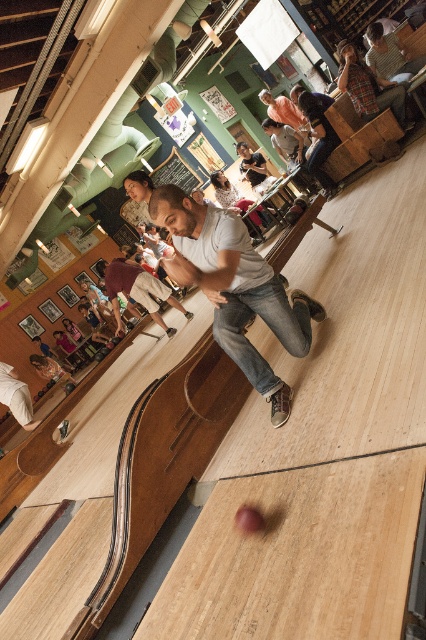
Question: Is white matte shirt at center smaller than maroon cotton shirt at center?

Choices:
 (A) no
 (B) yes

Answer: (A)

Question: Considering the real-world distances, which object is closest to the maroon cotton shirt at center?

Choices:
 (A) white cotton shirt at lower left
 (B) white matte shirt at center

Answer: (A)

Question: Is white matte shirt at center bigger than white cotton shirt at lower left?

Choices:
 (A) yes
 (B) no

Answer: (A)

Question: From the image, what is the correct spatial relationship of maroon cotton shirt at center in relation to white cotton shirt at lower left?

Choices:
 (A) right
 (B) left

Answer: (A)

Question: Which point appears closest to the camera in this image?

Choices:
 (A) (112, 264)
 (B) (302, 332)
 (C) (25, 420)

Answer: (B)

Question: Which of these objects is positioned farthest from the maroon cotton shirt at center?

Choices:
 (A) white matte shirt at center
 (B) white cotton shirt at lower left

Answer: (A)